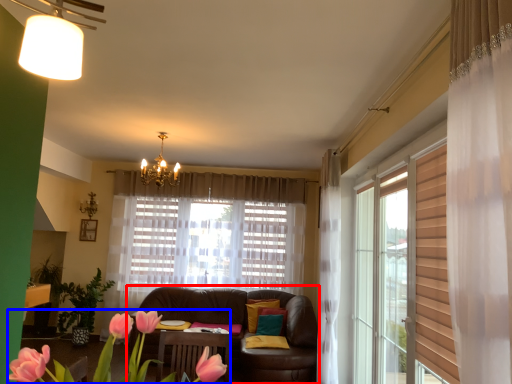
Question: Which object is further to the camera taking this photo, studio couch (highlighted by a red box) or floral arrangement (highlighted by a blue box)?

Choices:
 (A) studio couch
 (B) floral arrangement

Answer: (A)